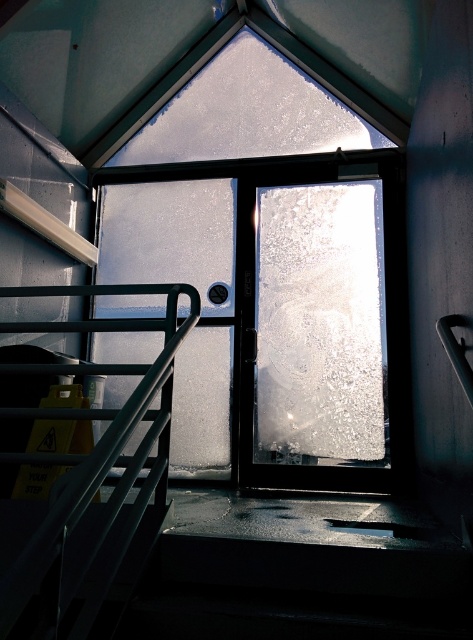
You are a delivery person carrying a large package that is 2 meters wide. You need to navigate around the metallic black handrail at upper left while approaching the frosted glass window at center. Can you fit through the space between them?

The distance between the frosted glass window at center and the metallic black handrail at upper left is 1.67 meters. Since your package is 2 meters wide, it is wider than the available space, so you cannot fit through the space between them.